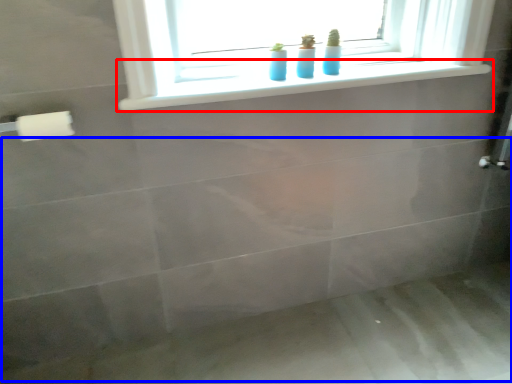
Question: Which object appears farthest to the camera in this image, window sill (highlighted by a red box) or bath (highlighted by a blue box)?

Choices:
 (A) window sill
 (B) bath

Answer: (A)